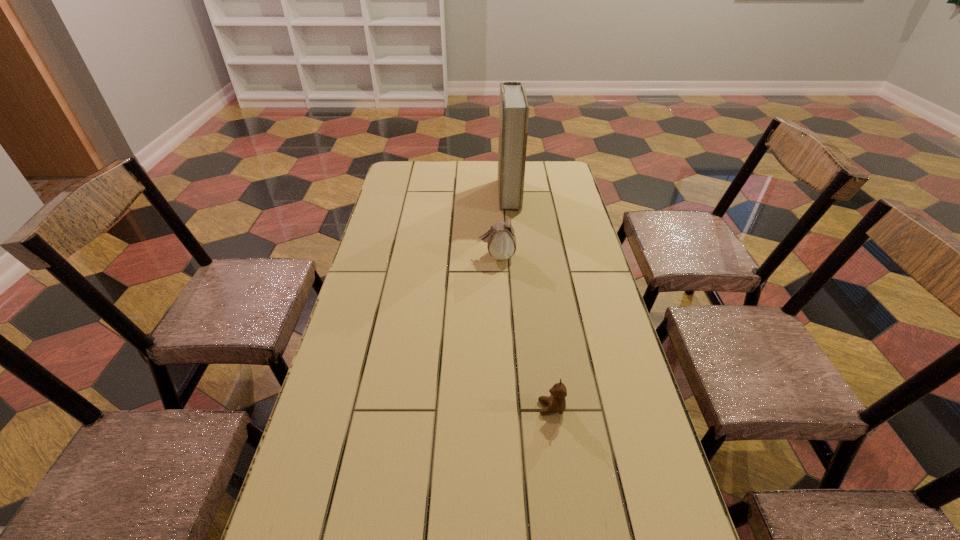
At what (x,y) coordinates should I click in order to perform the action: click on vacant region located 0.380m on the front-facing side of the second shortest object. Please return your answer as a coordinate pair (x, y). Looking at the image, I should click on (365, 256).

Image resolution: width=960 pixels, height=540 pixels. I want to click on vacant position located 0.260m on the front-facing side of the second shortest object, so click(x=401, y=256).

You are a GUI agent. You are given a task and a screenshot of the screen. Output one action in this format:
    pyautogui.click(x=<x>, y=<y>)
    Task: Click on the vacant space located on the front-facing side of the nearest object
    The height and width of the screenshot is (540, 960).
    Given the screenshot: What is the action you would take?
    pyautogui.click(x=467, y=408)

The image size is (960, 540). What are the coordinates of `vacant space located on the front-facing side of the nearest object` in the screenshot? It's located at (458, 408).

Locate an element on the screen. vacant area situated 0.320m on the front-facing side of the nearest object is located at coordinates (403, 408).

The height and width of the screenshot is (540, 960). I want to click on object that is at the far edge, so click(514, 110).

At what (x,y) coordinates should I click in order to perform the action: click on vacant space at the far edge. Please return your answer as a coordinate pair (x, y). The image size is (960, 540). Looking at the image, I should click on (492, 174).

In the image, there is a desktop. Where is `vacant space at the left edge`? The image size is (960, 540). vacant space at the left edge is located at coordinates (378, 224).

Identify the location of vacant region at the right edge. The height and width of the screenshot is (540, 960). (573, 256).

Where is `free space at the far right corner`? The height and width of the screenshot is (540, 960). free space at the far right corner is located at coordinates (539, 175).